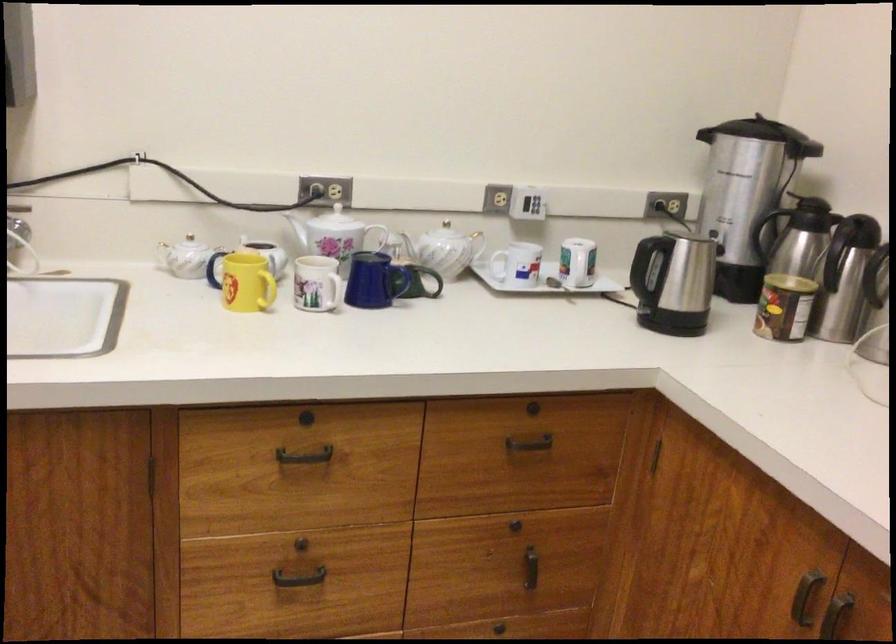
The height and width of the screenshot is (644, 896). Describe the element at coordinates (328, 216) in the screenshot. I see `the teapot lid handle` at that location.